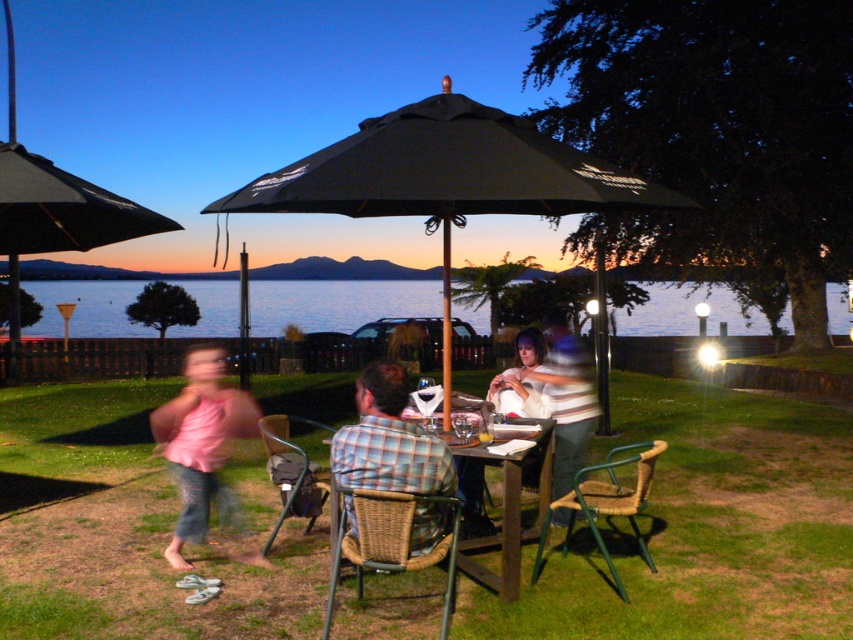
From the picture: You are standing at the edge of the grassy area in the outdoor dining scene. You see a point marked at coordinates (387, 440). Which object is this point located on?

The point at coordinates (387, 440) is located on the plaid fabric shirt at center.

Consider the image. You are a photographer trying to capture the blue water at center and the wooden table at center in the same frame. Based on their positions, which object should you adjust your camera to focus on first to ensure both are in the shot?

The blue water at center is to the left of wooden table at center, so you should focus on the blue water at center first to ensure both are included in the frame.